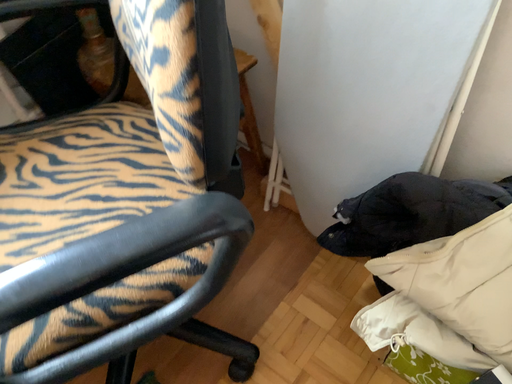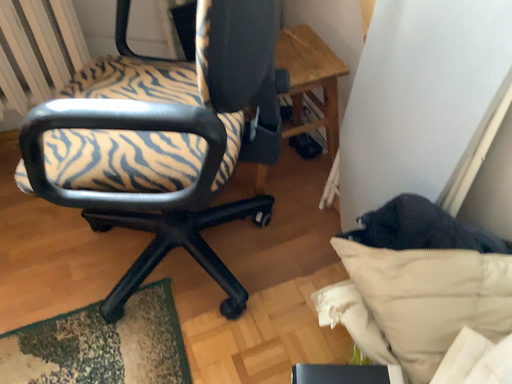
Question: How did the camera likely rotate when shooting the video?

Choices:
 (A) rotated left
 (B) rotated right

Answer: (A)